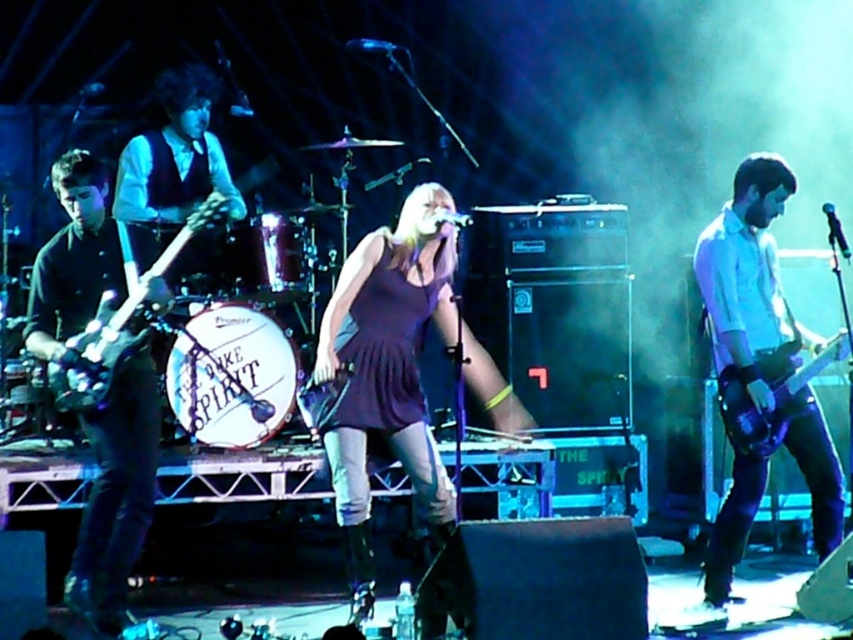
You are a stagehand who needs to move a 3.5 meter long extension cord from the matte black guitar at left to the shiny purple electric guitar at right. Can you safely lay the cord between them without it being stepped on by the performers?

The distance between the matte black guitar at left and the shiny purple electric guitar at right is 3.32 meters. Since the extension cord is 3.5 meters long, it will be slightly longer than the required distance, so laying it between them might leave a small amount of slack. However, the performers might step on it during their movements. To ensure safety, it would be better to secure the cord properly or use a slightly shorter one to avoid tripping hazards.

You are a stagehand who needs to place a new microphone stand between the shiny purple electric guitar at right and the shiny black electric guitar at left. Based on their widths, which guitar should be closer to the center of the stage to ensure the microphone stand fits comfortably?

The shiny purple electric guitar at right has a lesser width compared to the shiny black electric guitar at left. To ensure the microphone stand fits comfortably, the narrower shiny purple electric guitar at right should be placed closer to the center of the stage, allowing more space between the wider shiny black electric guitar at left and the microphone stand.

You are a stagehand needing to adjust the microphone stand between the shiny purple electric guitar at right and the shiny black electric guitar at left. Which guitar is closer to the front of the stage?

The shiny purple electric guitar at right is closer to the front of the stage because it is further to the viewer than the shiny black electric guitar at left.